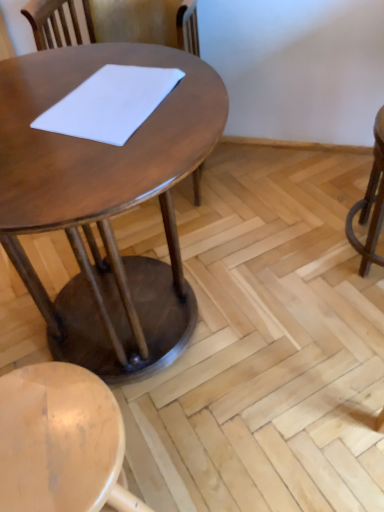
Question: From the image's perspective, is white matte notepad at center located above or below shiny brown table at center?

Choices:
 (A) below
 (B) above

Answer: (B)

Question: From a real-world perspective, is white matte notepad at center positioned above or below shiny brown table at center?

Choices:
 (A) below
 (B) above

Answer: (B)

Question: Estimate the real-world distances between objects in this image. Which object is closer to the shiny brown table at center?

Choices:
 (A) light wood stool at lower left
 (B) white matte notepad at center

Answer: (B)

Question: Which object is positioned farthest from the shiny brown table at center?

Choices:
 (A) white matte notepad at center
 (B) light wood stool at lower left

Answer: (B)